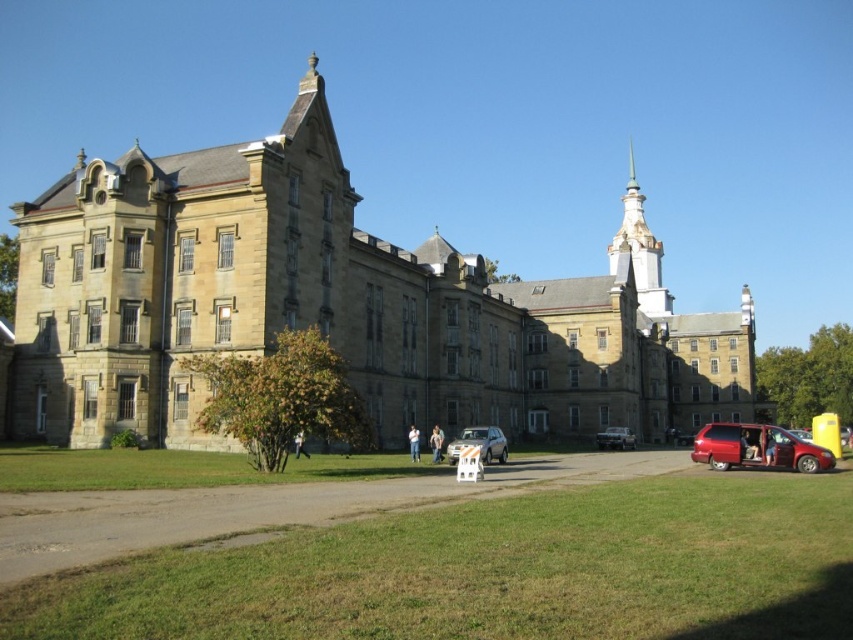
You are a delivery person who needs to park your matte silver sedan at center in a parking space that is exactly the width of the light blue jeans at center. Will your car fit in the space?

The matte silver sedan at center is wider than the light blue jeans at center, so it will not fit in the parking space that is exactly the width of the light blue jeans at center.

In the scene shown: You are standing at the entrance of the historic stone building and want to park your shiny red minivan at lower right. The parking spot you desire is at coordinate point A. If the minivan is currently at coordinate point B, which direction should you drive to reach the parking spot?

The shiny red minivan at lower right is located at point B. To reach point A, you should drive north.